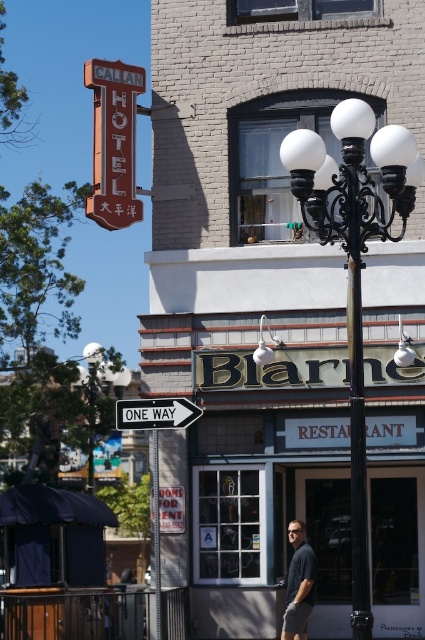
Question: Can you confirm if white plastic one way sign at center is positioned to the right of white glass lamp at center?

Choices:
 (A) no
 (B) yes

Answer: (A)

Question: Which point is farther from the camera taking this photo?

Choices:
 (A) click(113, 372)
 (B) click(163, 413)
 (C) click(172, 500)

Answer: (A)

Question: Which is farther from the metallic pole at center?

Choices:
 (A) white glass globe streetlight at center
 (B) white glass streetlight at center
 (C) blue denim jeans at lower center
 (D) red plastic sign at center

Answer: (B)

Question: Is blue denim jeans at lower center above white glass streetlight at center?

Choices:
 (A) no
 (B) yes

Answer: (A)

Question: Among these points, which one is nearest to the camera?

Choices:
 (A) (176, 513)
 (B) (396, 141)
 (C) (402, 364)

Answer: (B)

Question: Is white plastic one way sign at center below red plastic sign at center?

Choices:
 (A) yes
 (B) no

Answer: (B)